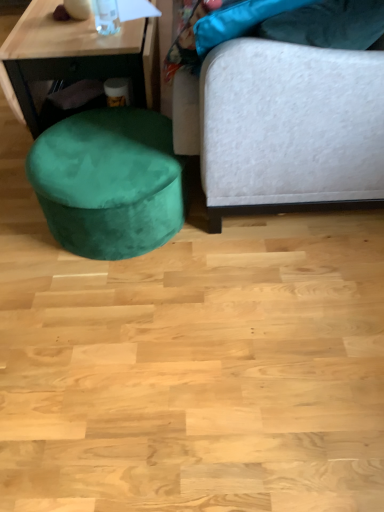
At what (x,y) coordinates should I click in order to perform the action: click on spots to the right of velvet green ottoman at lower left. Please return your answer as a coordinate pair (x, y). Looking at the image, I should click on (248, 248).